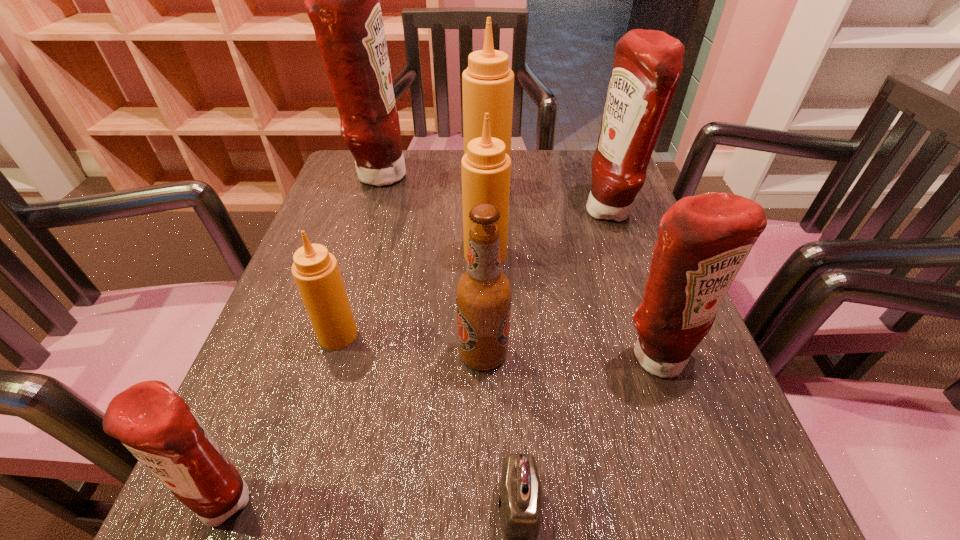
The image size is (960, 540). I want to click on the tallest object, so click(342, 1).

Find the location of a particular element. the biggest red condiment is located at coordinates pos(342,1).

Where is `the farthest tan condiment`? the farthest tan condiment is located at coordinates (488, 83).

Where is `the third smallest red condiment`? This screenshot has width=960, height=540. the third smallest red condiment is located at coordinates (647, 65).

Find the location of `the third biggest red condiment`. the third biggest red condiment is located at coordinates (704, 240).

The height and width of the screenshot is (540, 960). Find the location of `the fourth nearest condiment`. the fourth nearest condiment is located at coordinates (486, 168).

Where is `the fourth farthest object`? the fourth farthest object is located at coordinates (486, 168).

Find the location of `beer bottle`. beer bottle is located at coordinates (483, 292).

The height and width of the screenshot is (540, 960). Find the location of `the smallest tan condiment`. the smallest tan condiment is located at coordinates (316, 272).

At what (x,y) coordinates should I click in order to perform the action: click on the nearest tan condiment. Please return your answer as a coordinate pair (x, y). Looking at the image, I should click on (316, 272).